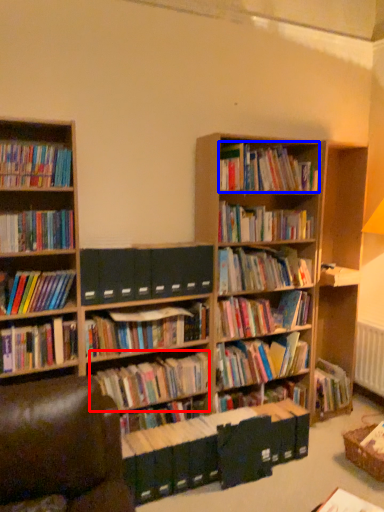
Question: Among these objects, which one is farthest to the camera, book (highlighted by a red box) or book (highlighted by a blue box)?

Choices:
 (A) book
 (B) book

Answer: (B)